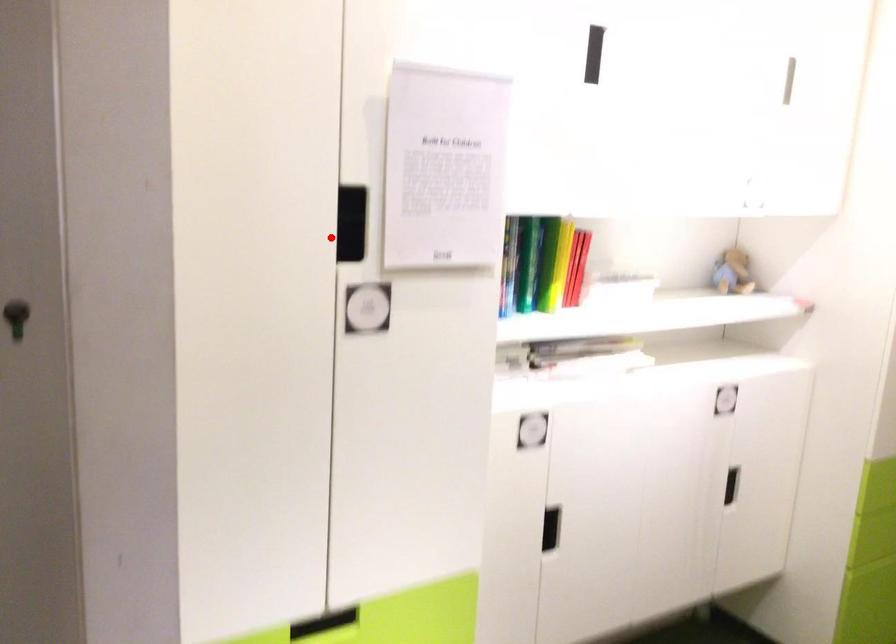
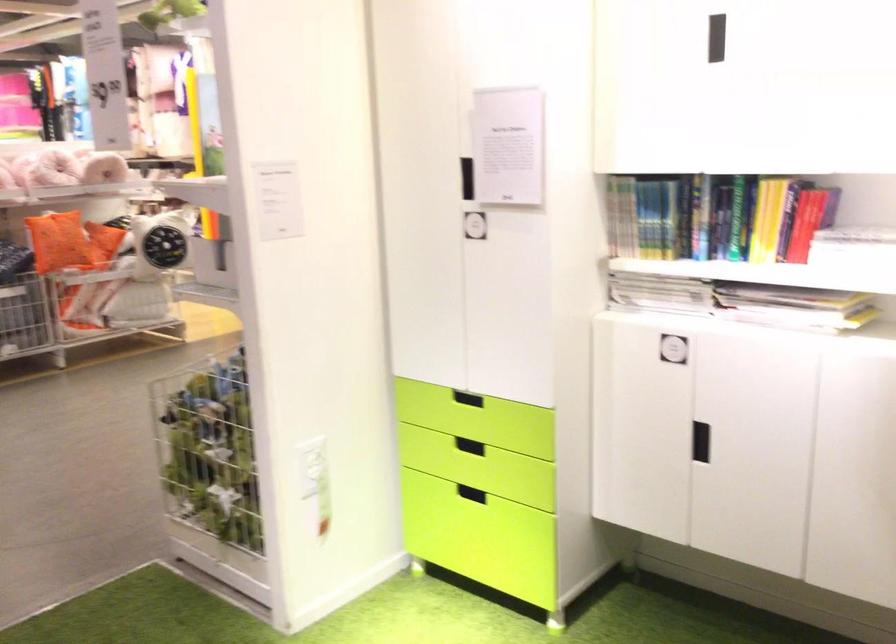
Question: I am providing you with two images of the same scene from different viewpoints. Given a red point in image1, look at the same physical point in image2. Is it:

Choices:
 (A) Closer to the viewpoint
 (B) Farther from the viewpoint

Answer: (B)